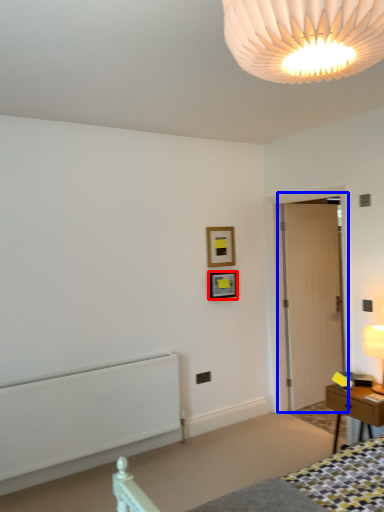
Question: Which point is closer to the camera, picture frame (highlighted by a red box) or door (highlighted by a blue box)?

Choices:
 (A) picture frame
 (B) door

Answer: (B)